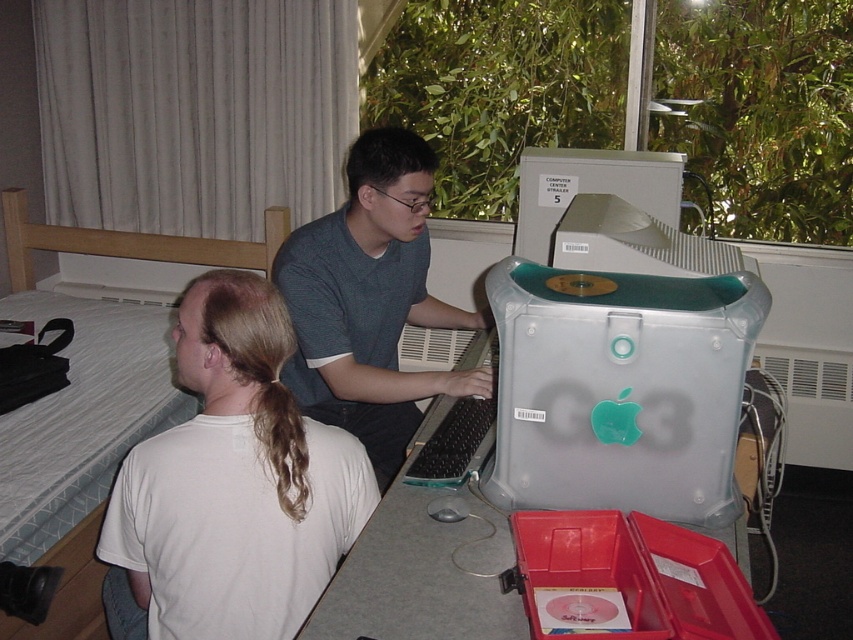
You are organizing a study session in the dorm room and need to place a notebook on the desk. The desk has limited space. Which object, the white matte shirt at back or the gray plastic desktop computer at upper center, should you place the notebook under to maximize desk space?

The white matte shirt at back is below the gray plastic desktop computer at upper center, so placing the notebook under the gray plastic desktop computer at upper center would utilize the space below it, maximizing desk space.

You are organizing a closet and see the white matte shirt at back and the matte gray shirt at center. Which shirt is positioned closer to the entrance of the closet?

The white matte shirt at back is closer to the viewer than the matte gray shirt at center, so the white matte shirt at back is positioned closer to the entrance of the closet.